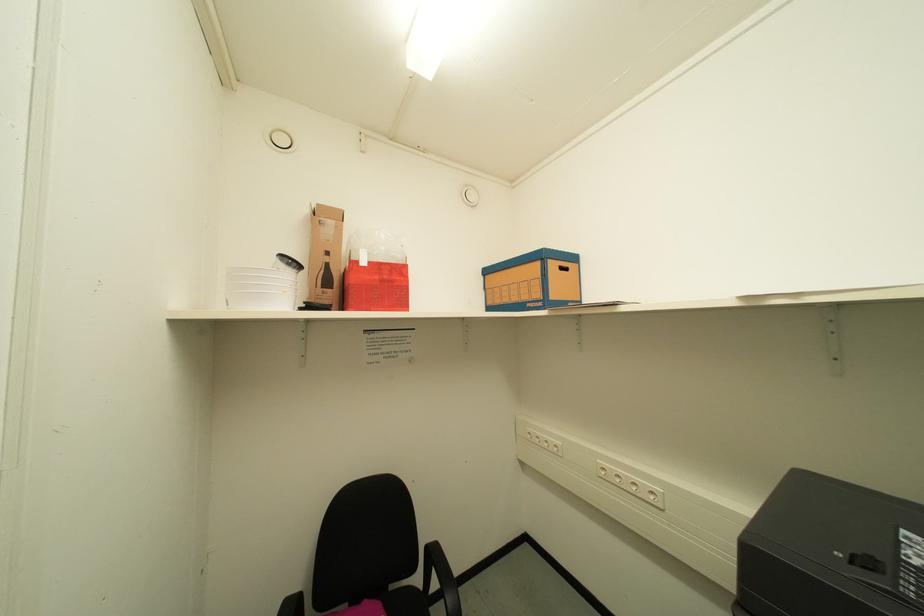
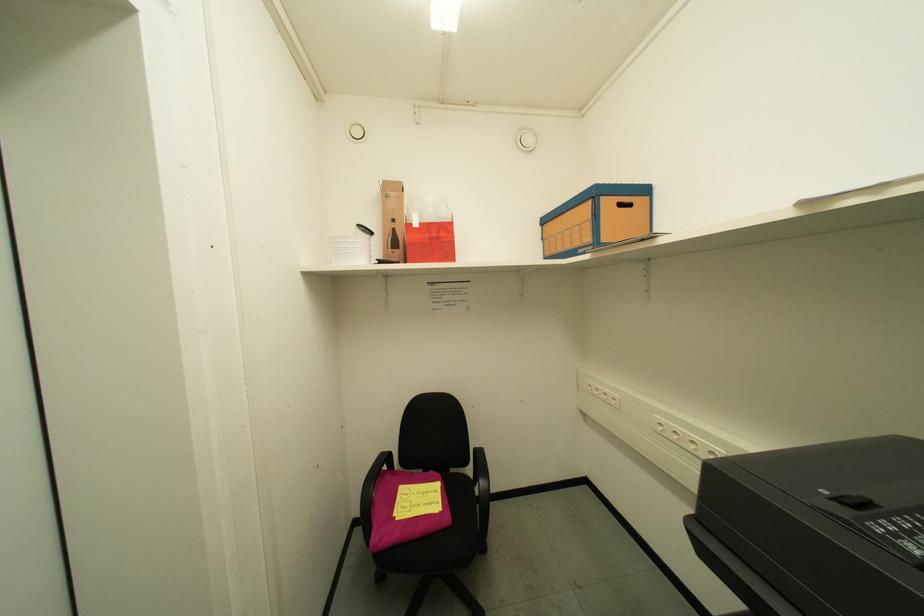
Question: Which direction would the cameraman need to move to produce the second image? Reply with the corresponding letter.

Choices:
 (A) Left
 (B) Right
 (C) Forward
 (D) Backward

Answer: (B)